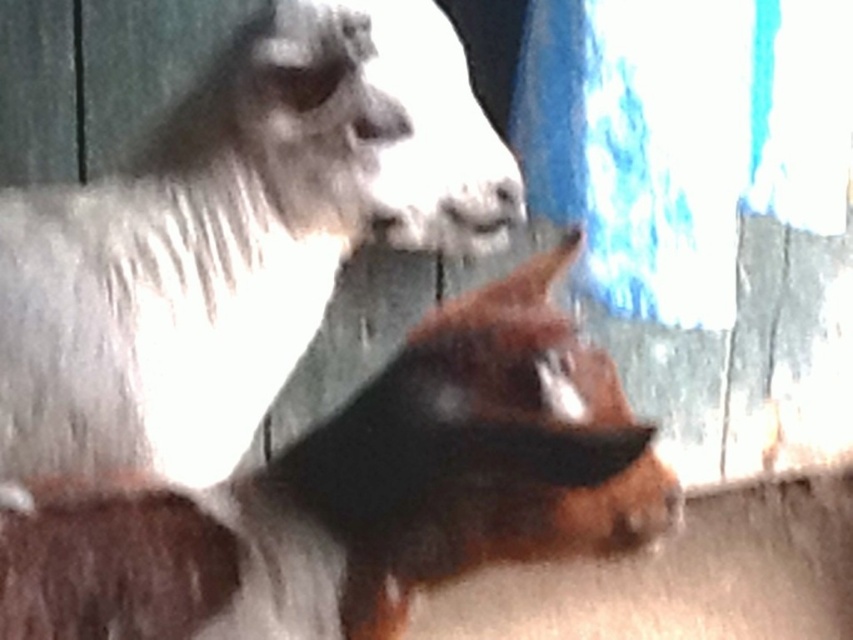
Question: From the image, what is the correct spatial relationship of brown woolen sheep at center in relation to brown furry dog at center?

Choices:
 (A) right
 (B) left

Answer: (B)

Question: Which object appears farthest from the camera in this image?

Choices:
 (A) brown woolen sheep at center
 (B) brown furry dog at center

Answer: (A)

Question: Where is brown woolen sheep at center located in relation to brown furry dog at center in the image?

Choices:
 (A) above
 (B) below

Answer: (A)

Question: Does brown woolen sheep at center appear under brown furry dog at center?

Choices:
 (A) yes
 (B) no

Answer: (B)

Question: Which of the following is the closest to the observer?

Choices:
 (A) (534, 275)
 (B) (308, 10)

Answer: (A)